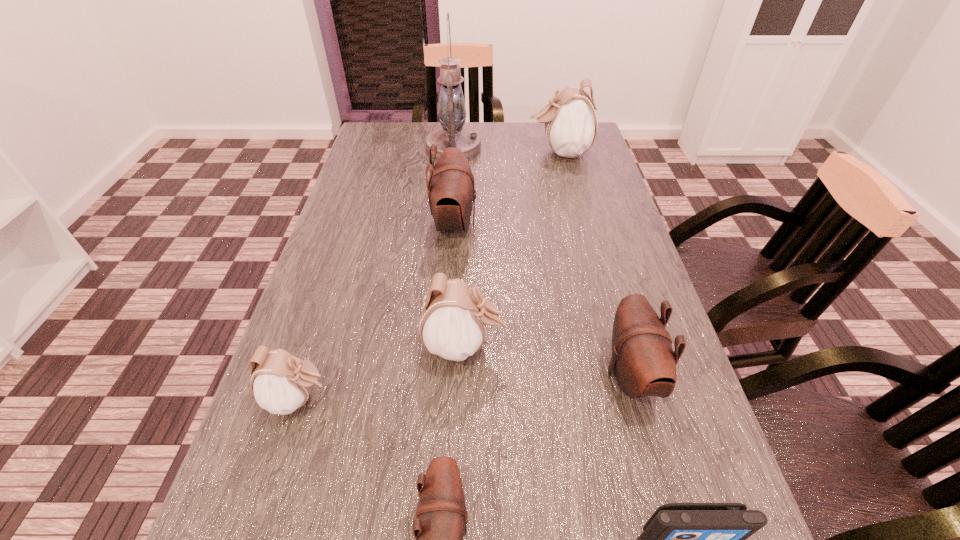
Locate which brown pouch ranks second in proximity to the rightmost brown pouch. Please provide its 2D coordinates. Your answer should be formatted as a tuple, i.e. [(x, y)], where the tuple contains the x and y coordinates of a point satisfying the conditions above.

[(451, 190)]

Identify which brown pouch is located as the nearest to the rightmost brown pouch. Please provide its 2D coordinates. Your answer should be formatted as a tuple, i.e. [(x, y)], where the tuple contains the x and y coordinates of a point satisfying the conditions above.

[(441, 516)]